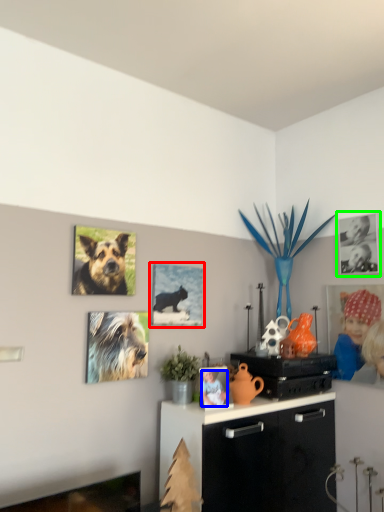
Question: Which object is the closest to the picture frame (highlighted by a red box)? Choose among these: person (highlighted by a blue box) or picture frame (highlighted by a green box).

Choices:
 (A) person
 (B) picture frame

Answer: (A)